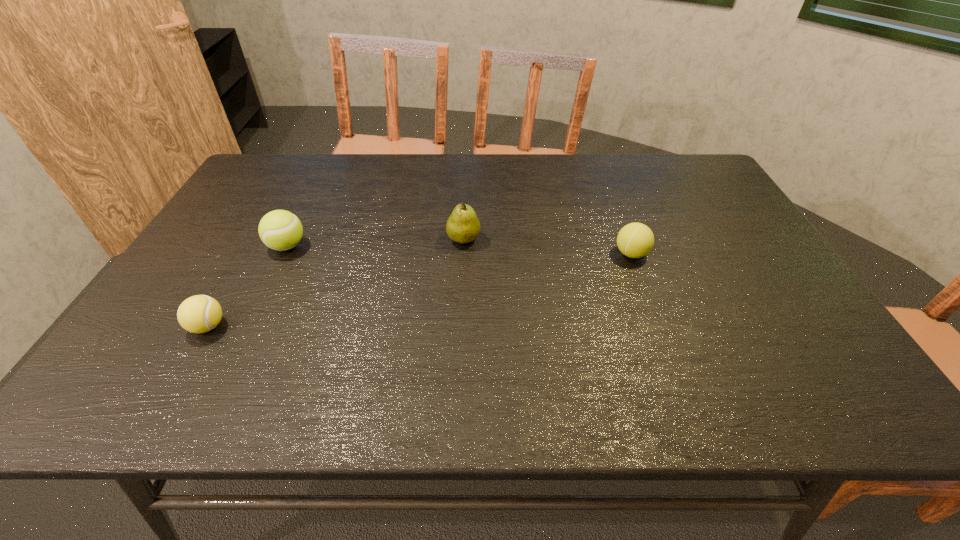
You are a GUI agent. You are given a task and a screenshot of the screen. Output one action in this format:
    pyautogui.click(x=<x>, y=<y>)
    Task: Click on the empty space that is in between the third shortest object and the pear
    This screenshot has height=540, width=960.
    Given the screenshot: What is the action you would take?
    375,242

Locate an element on the screen. Image resolution: width=960 pixels, height=540 pixels. unoccupied position between the nearest object and the rightmost tennis ball is located at coordinates (420, 290).

Identify the location of free spot between the third shortest object and the nearest tennis ball. The image size is (960, 540). (248, 286).

I want to click on unoccupied area between the nearest tennis ball and the tallest tennis ball, so click(248, 286).

In order to click on free area in between the third shortest object and the nearest object in this screenshot , I will do `click(248, 286)`.

Identify which object is the closest to the nearest object. Please provide its 2D coordinates. Your answer should be formatted as a tuple, i.e. [(x, y)], where the tuple contains the x and y coordinates of a point satisfying the conditions above.

[(281, 230)]

In order to click on object that is the third closest to the third shortest object in this screenshot , I will do `click(635, 240)`.

At what (x,y) coordinates should I click in order to perform the action: click on tennis ball object that ranks as the closest to the nearest tennis ball. Please return your answer as a coordinate pair (x, y). Image resolution: width=960 pixels, height=540 pixels. Looking at the image, I should click on (281, 230).

You are a GUI agent. You are given a task and a screenshot of the screen. Output one action in this format:
    pyautogui.click(x=<x>, y=<y>)
    Task: Click on the second closest tennis ball relative to the second object from right to left
    The width and height of the screenshot is (960, 540).
    Given the screenshot: What is the action you would take?
    pyautogui.click(x=281, y=230)